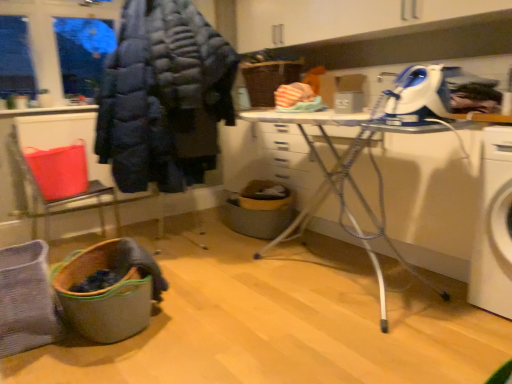
Question: From a real-world perspective, is dark blue puffer jacket at upper left located beneath white plastic ironing board at center?

Choices:
 (A) yes
 (B) no

Answer: (B)

Question: Considering the relative sizes of dark blue puffer jacket at upper left and white plastic ironing board at center in the image provided, is dark blue puffer jacket at upper left thinner than white plastic ironing board at center?

Choices:
 (A) yes
 (B) no

Answer: (B)

Question: Does dark blue puffer jacket at upper left have a greater height compared to white plastic ironing board at center?

Choices:
 (A) no
 (B) yes

Answer: (B)

Question: Is the surface of dark blue puffer jacket at upper left in direct contact with white plastic ironing board at center?

Choices:
 (A) no
 (B) yes

Answer: (A)

Question: Is dark blue puffer jacket at upper left at the left side of white plastic ironing board at center?

Choices:
 (A) no
 (B) yes

Answer: (B)

Question: From a real-world perspective, is dark blue puffer jacket at upper left on top of white plastic ironing board at center?

Choices:
 (A) no
 (B) yes

Answer: (B)

Question: Does dark blue puffer jacket at upper left have a smaller size compared to wooden laundry basket at lower left?

Choices:
 (A) yes
 (B) no

Answer: (B)

Question: Is dark blue puffer jacket at upper left bigger than wooden laundry basket at lower left?

Choices:
 (A) no
 (B) yes

Answer: (B)

Question: From a real-world perspective, is dark blue puffer jacket at upper left under wooden laundry basket at lower left?

Choices:
 (A) no
 (B) yes

Answer: (A)

Question: From the image's perspective, is dark blue puffer jacket at upper left located beneath wooden laundry basket at lower left?

Choices:
 (A) yes
 (B) no

Answer: (B)

Question: Is dark blue puffer jacket at upper left outside of wooden laundry basket at lower left?

Choices:
 (A) yes
 (B) no

Answer: (A)

Question: Does dark blue puffer jacket at upper left come in front of wooden laundry basket at lower left?

Choices:
 (A) yes
 (B) no

Answer: (B)

Question: Is white plastic ironing board at center bigger than dark blue puffer jacket at upper left?

Choices:
 (A) yes
 (B) no

Answer: (A)